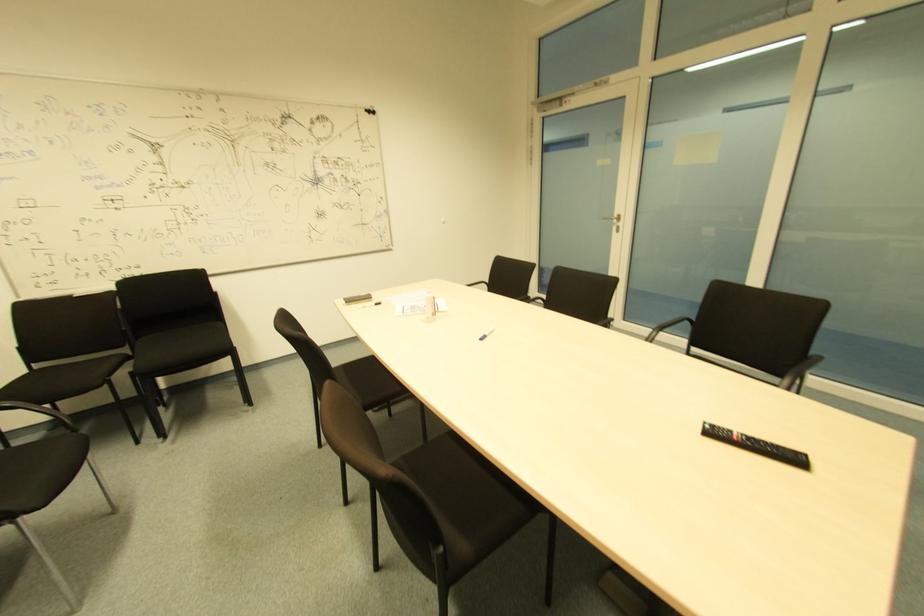
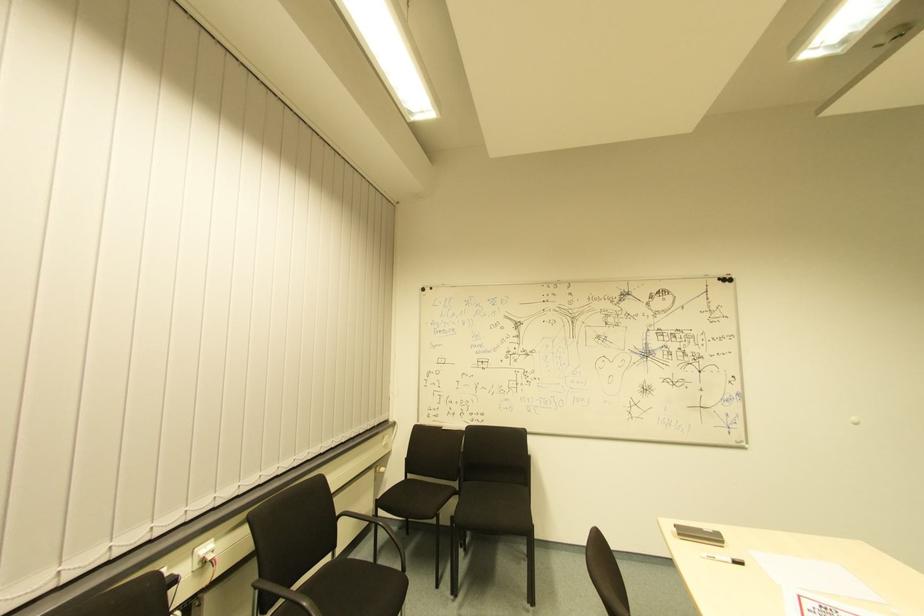
Locate, in the second image, the point that corresponds to (x=377, y=307) in the first image.

(737, 565)